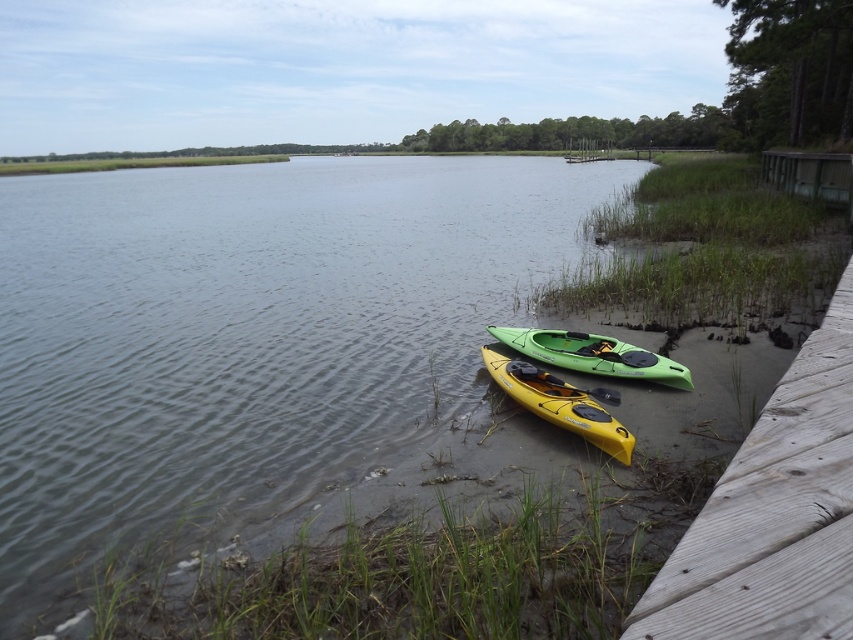
Question: Which point is closer to the camera taking this photo?

Choices:
 (A) (610, 454)
 (B) (775, 520)
 (C) (616, 403)

Answer: (B)

Question: Which object is farther from the camera taking this photo?

Choices:
 (A) yellow matte paddle at lower center
 (B) wooden at lower right
 (C) green plastic canoe at lower center
 (D) green plastic kayak at lower center

Answer: (C)

Question: Considering the relative positions of yellow matte kayak at lower center and yellow matte paddle at lower center in the image provided, where is yellow matte kayak at lower center located with respect to yellow matte paddle at lower center?

Choices:
 (A) below
 (B) above

Answer: (B)

Question: Is wooden at lower right to the right of green plastic canoe at lower center from the viewer's perspective?

Choices:
 (A) no
 (B) yes

Answer: (A)

Question: Which of the following is the farthest from the observer?

Choices:
 (A) (804, 484)
 (B) (529, 365)
 (C) (310, 483)

Answer: (B)

Question: Does wooden at lower right have a greater width compared to green plastic canoe at lower center?

Choices:
 (A) no
 (B) yes

Answer: (A)